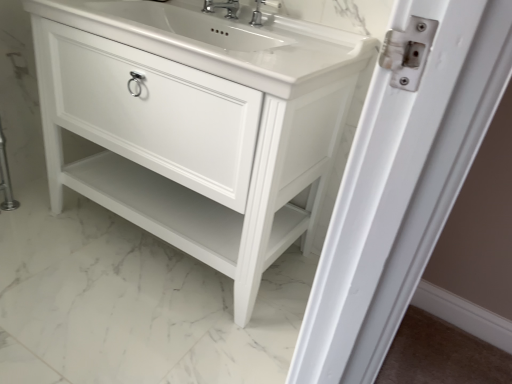
Question: Is point (206, 11) closer or farther from the camera than point (325, 69)?

Choices:
 (A) closer
 (B) farther

Answer: (B)

Question: From their relative heights in the image, would you say polished chrome faucet at upper center, the first tap viewed from the left, is taller or shorter than white glossy sink at center?

Choices:
 (A) short
 (B) tall

Answer: (A)

Question: Estimate the real-world distances between objects in this image. Which object is farther from the polished chrome faucet at upper center, which is the 1th tap from right to left?

Choices:
 (A) white glossy sink at center
 (B) polished chrome faucet at upper center, the 2th tap from the right
 (C) white glossy cabinet at center

Answer: (C)

Question: Estimate the real-world distances between objects in this image. Which object is closer to the white glossy sink at center?

Choices:
 (A) white glossy cabinet at center
 (B) polished chrome faucet at upper center, positioned as the 2th tap in left-to-right order
 (C) polished chrome faucet at upper center, the first tap viewed from the left

Answer: (A)